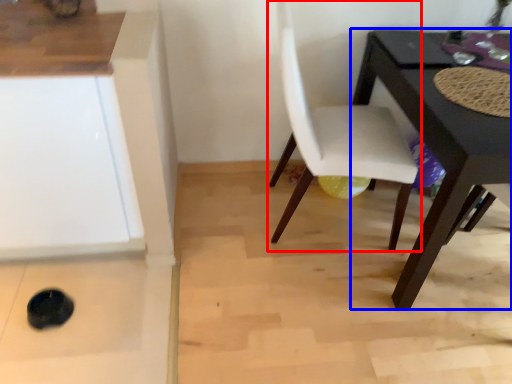
Question: Which object is closer to the camera taking this photo, chair (highlighted by a red box) or table (highlighted by a blue box)?

Choices:
 (A) chair
 (B) table

Answer: (B)